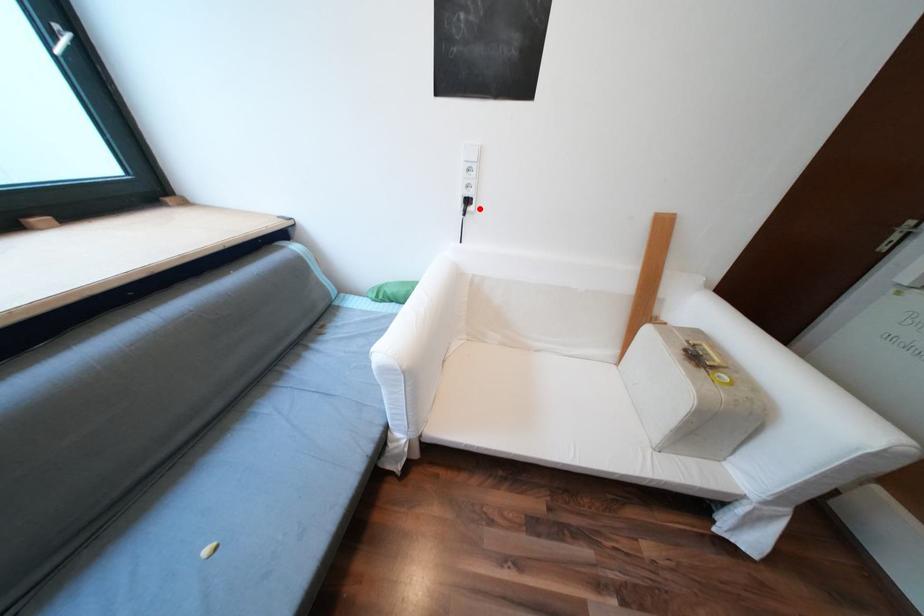
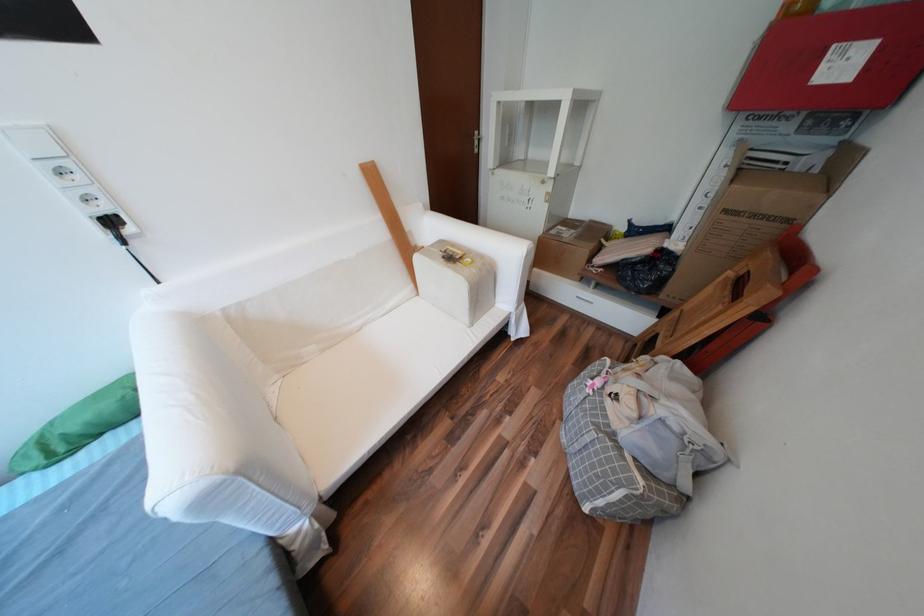
Question: I am providing you with two images of the same scene from different viewpoints. In image1, a red point is highlighted. Considering the same 3D point in image2, which of the following is correct?

Choices:
 (A) It is closer
 (B) It is farther

Answer: (B)